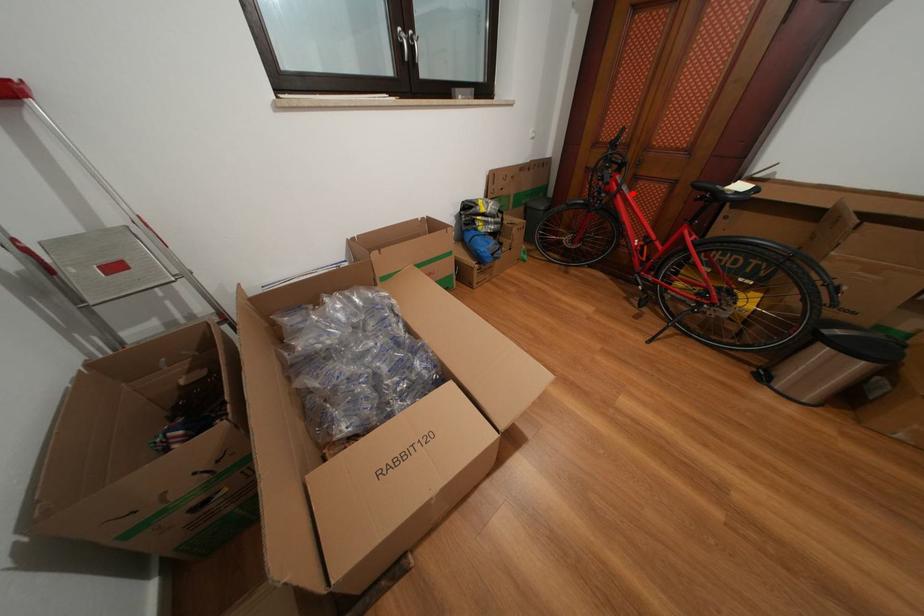
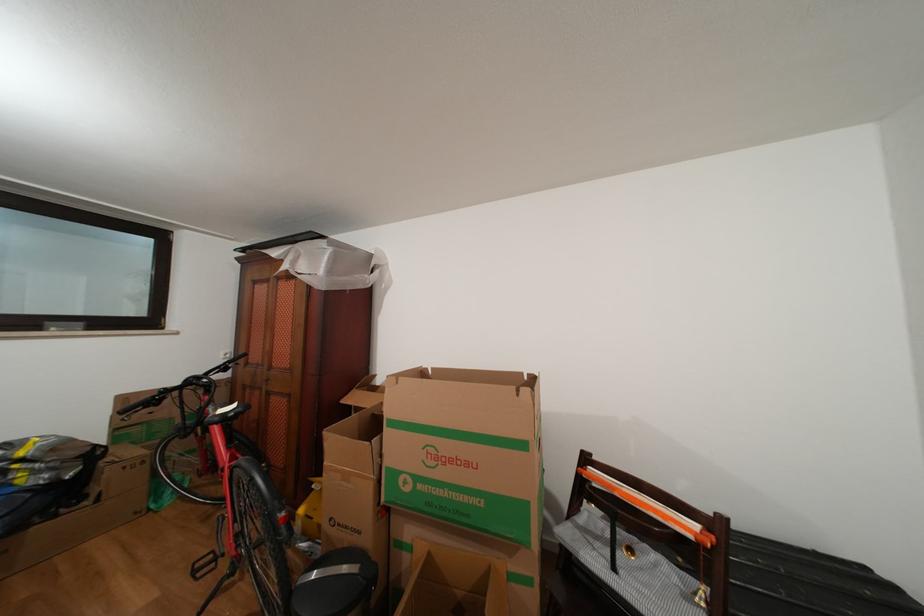
Question: I am providing you with two images of the same scene from different viewpoints. Image1 has a red point marked. In image2, the corresponding 3D location appears at what relative position? Reply with the corresponding letter.

Choices:
 (A) Closer
 (B) Farther

Answer: (B)